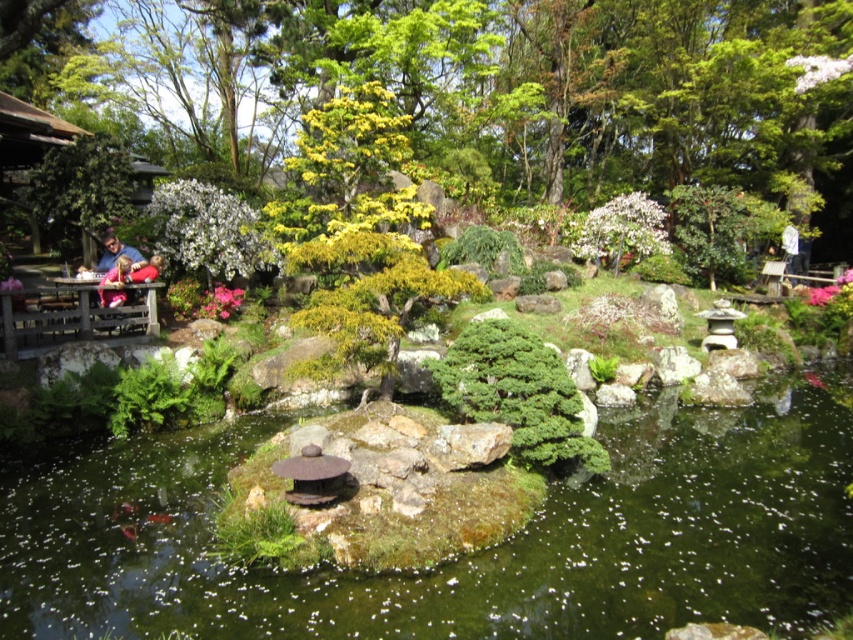
Question: Which point is closer to the camera?

Choices:
 (A) (612, 224)
 (B) (712, 580)
 (C) (164, 115)

Answer: (B)

Question: Is pink matte flower at upper right smaller than pink matte flower at upper left?

Choices:
 (A) no
 (B) yes

Answer: (A)

Question: Is the position of white matte flower at center less distant than that of white fluffy cloud at upper right?

Choices:
 (A) yes
 (B) no

Answer: (A)

Question: Which point is closer to the camera?

Choices:
 (A) (114, 300)
 (B) (109, 444)

Answer: (B)

Question: Estimate the real-world distances between objects in this image. Which object is closer to the matte red shirt at left?

Choices:
 (A) pink matte flower at upper left
 (B) pink matte flower at upper right
 (C) green leafy tree at upper center
 (D) white matte flower at center

Answer: (A)

Question: Is white fluffy cloud at upper right further to the viewer compared to matte blue shirt at left?

Choices:
 (A) no
 (B) yes

Answer: (B)